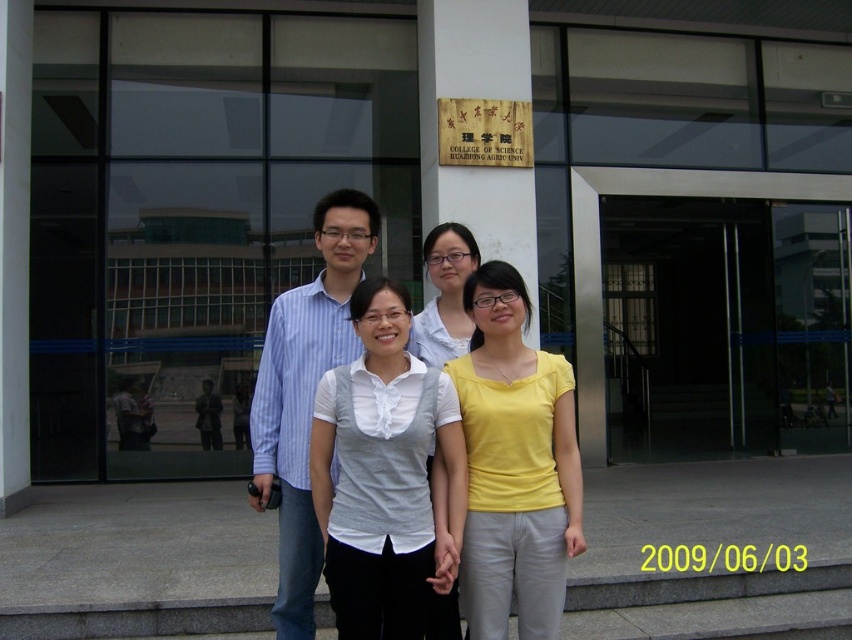
You are a photographer standing in front of the building and want to take a group photo of the yellow matte shirt at center and the matte white blouse at center. Which one is positioned to the right side from your perspective?

The yellow matte shirt at center is positioned to the right of the matte white blouse at center.

You are a photographer trying to capture a clear shot of the yellow matte shirt at center and the matte white blouse at center. Since the two are overlapping, which one should you focus on to ensure the other remains visible in the background?

The yellow matte shirt at center is in front of the matte white blouse at center, so focusing on the yellow matte shirt at center will allow the matte white blouse at center to stay visible in the background.